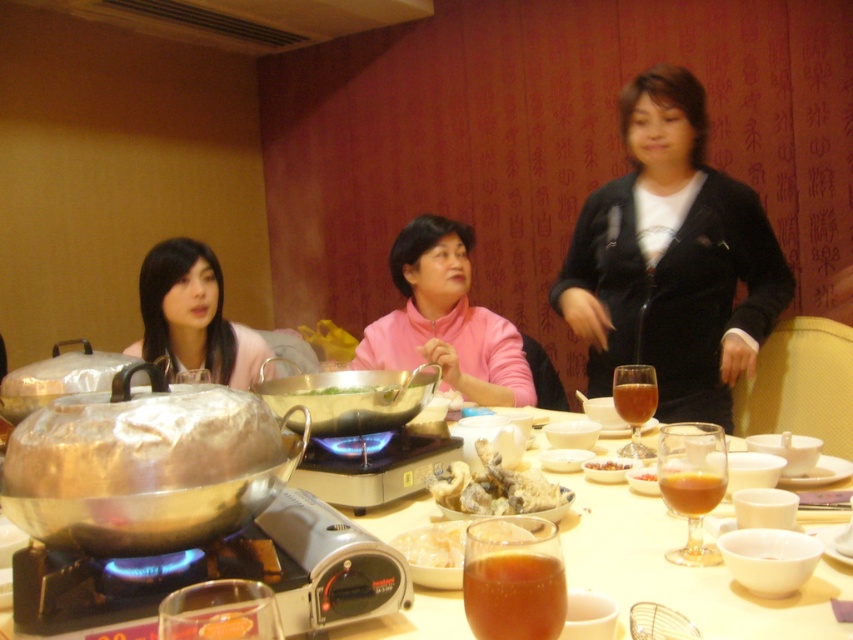
Based on the photo, does golden crispy chicken at center appear on the right side of green leafy vegetables at center?

Indeed, golden crispy chicken at center is positioned on the right side of green leafy vegetables at center.

Is golden crispy chicken at center thinner than green leafy vegetables at center?

Correct, golden crispy chicken at center's width is less than green leafy vegetables at center's.

What do you see at coordinates (496, 486) in the screenshot? I see `golden crispy chicken at center` at bounding box center [496, 486].

At what (x,y) coordinates should I click in order to perform the action: click on golden crispy chicken at center. Please return your answer as a coordinate pair (x, y). Looking at the image, I should click on (496, 486).

Does point (611, 572) lie in front of point (491, 401)?

Yes.

Which is below, metallic silver pot at center or pink fleece at center?

metallic silver pot at center

I want to click on metallic silver pot at center, so click(x=680, y=570).

Based on the photo, between metallic silver pot at center and translucent white noodles at center, which one is positioned lower?

translucent white noodles at center is lower down.

At what (x,y) coordinates should I click in order to perform the action: click on metallic silver pot at center. Please return your answer as a coordinate pair (x, y). Looking at the image, I should click on (680, 570).

Describe the element at coordinates (680, 570) in the screenshot. The width and height of the screenshot is (853, 640). I see `metallic silver pot at center` at that location.

Where is `metallic silver pot at center`? metallic silver pot at center is located at coordinates (680, 570).